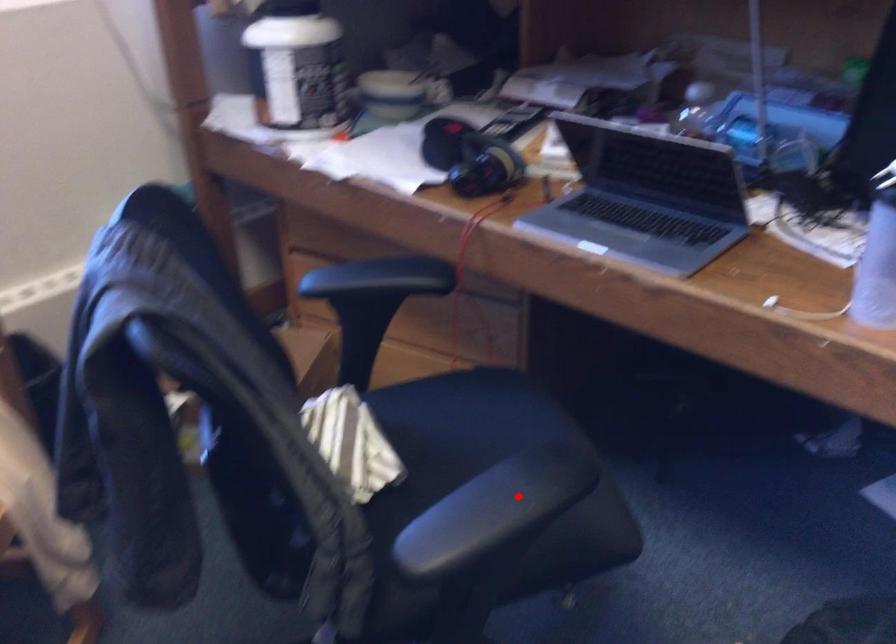
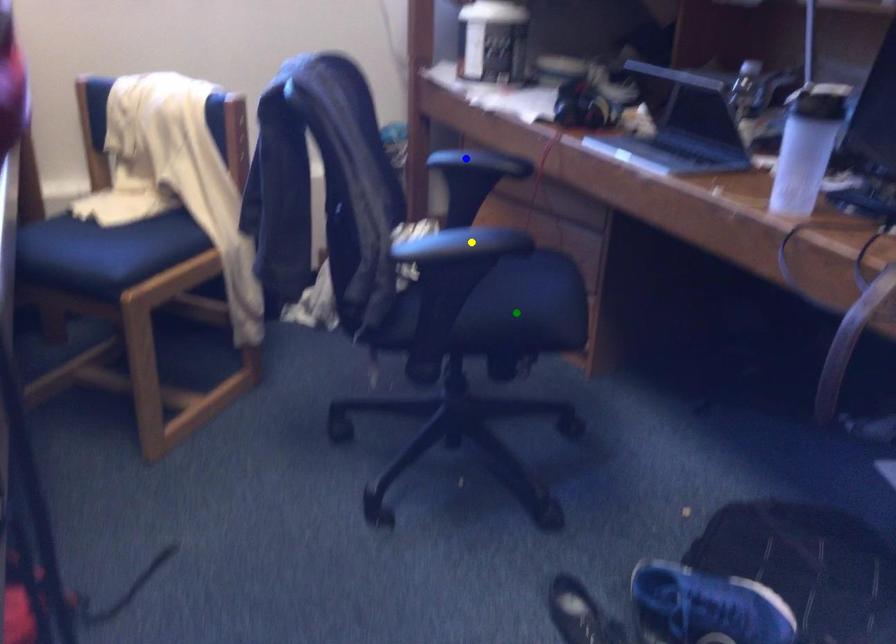
Question: I am providing you with two images of the same scene from different viewpoints. A red point is marked on the first image. You are given multiple points on the second image. Which spot in image 2 lines up with the point in image 1?

Choices:
 (A) yellow point
 (B) blue point
 (C) green point

Answer: (A)